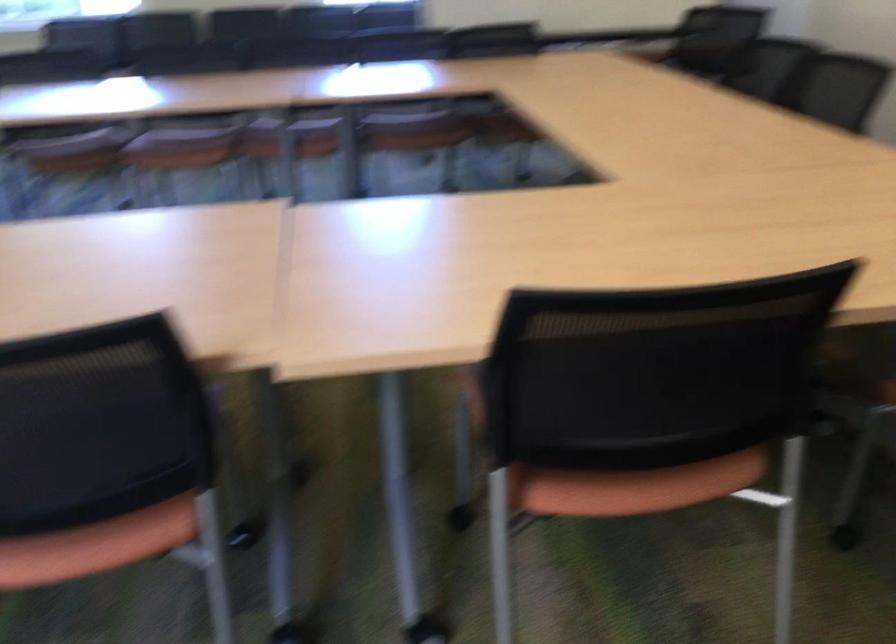
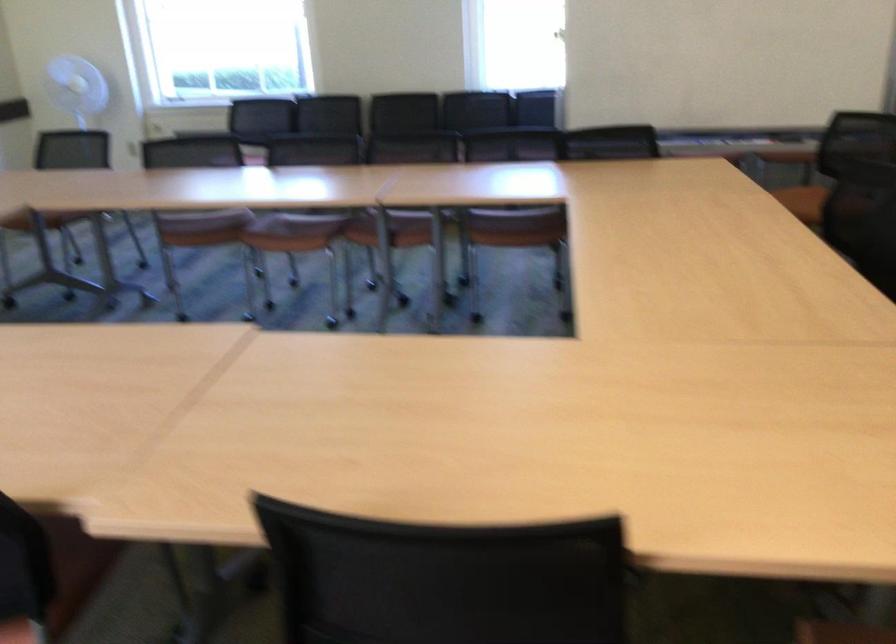
The point at (586, 366) is marked in the first image. Where is the corresponding point in the second image?

(444, 579)